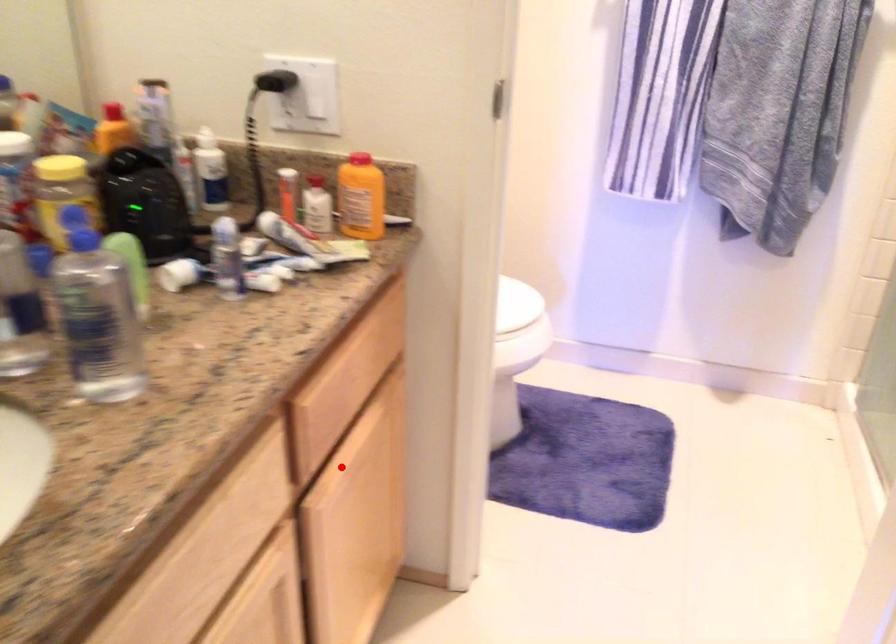
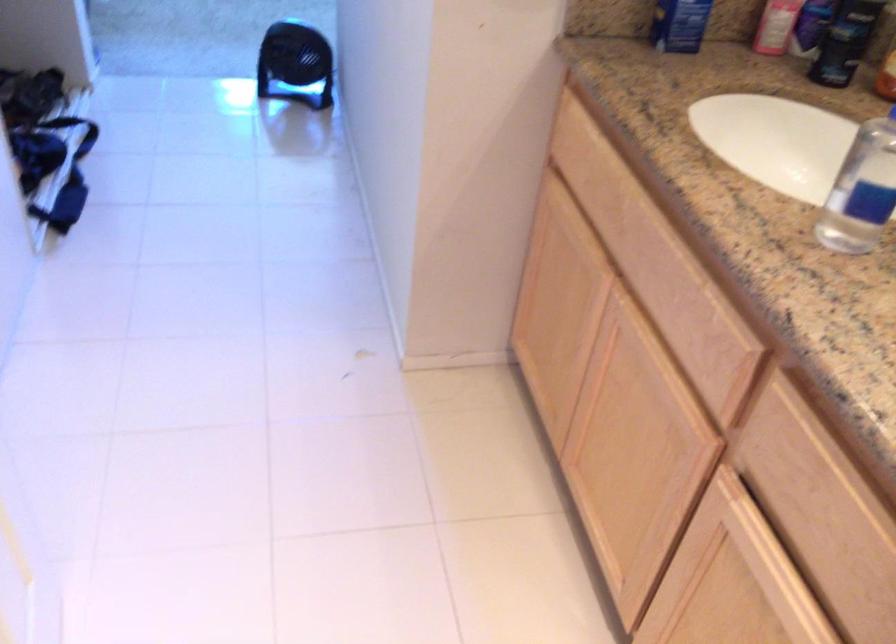
Question: I am providing you with two images of the same scene from different viewpoints. Given a red point in image1, look at the same physical point in image2. Is it:

Choices:
 (A) Closer to the viewpoint
 (B) Farther from the viewpoint

Answer: (A)